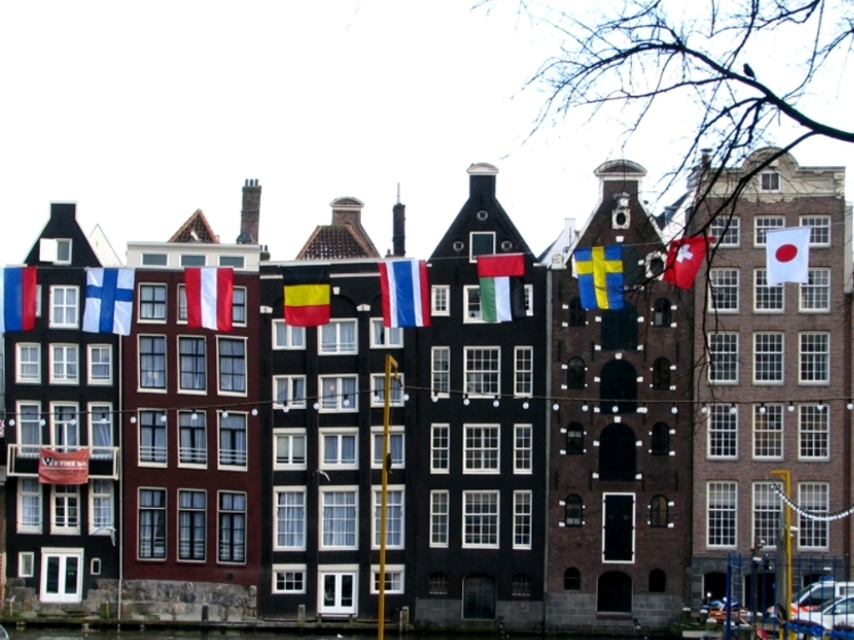
You are a tourist standing in front of the Dutch canal buildings. You notice two flags flying above you. The first is the yellow and black striped flag at center, and the second is the white fabric flag at upper right. Which flag is wider?

The yellow and black striped flag at center is wider than the white fabric flag at upper right.

You are a tourist in Amsterdam and notice two flags displayed on the buildings. The yellow and black striped flag at center and the matte black flag at left. Which flag is larger in size?

The yellow and black striped flag at center has a smaller size compared to matte black flag at left, so the matte black flag at left is larger.

You are a tourist standing in front of the Dutch canal buildings. You notice two flags displayed on the buildings. The first is the yellow and black striped flag at center, and the second is the matte black flag at left. Which flag is closer to you?

The yellow and black striped flag at center is closer to you because it is in front of the matte black flag at left.